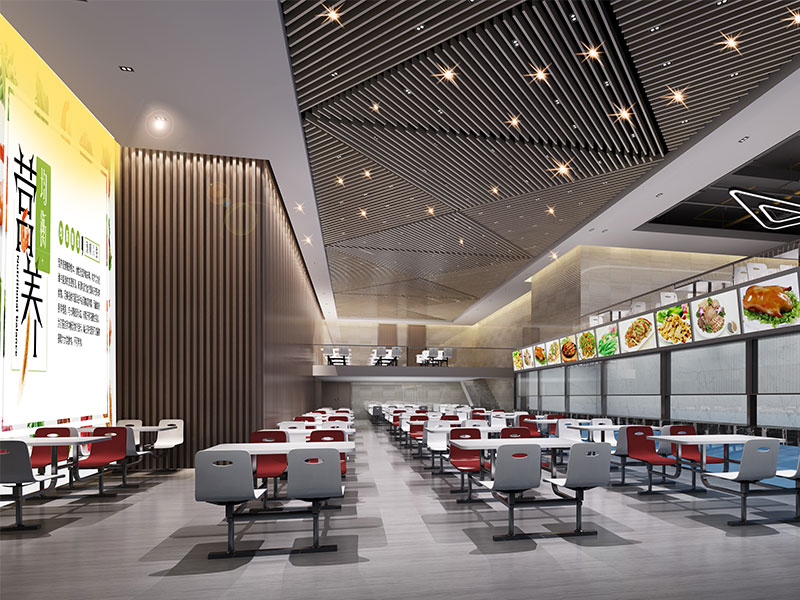
You are a GUI agent. You are given a task and a screenshot of the screen. Output one action in this format:
    pyautogui.click(x=<x>, y=<y>)
    Task: Click on the window
    
    Given the screenshot: What is the action you would take?
    pyautogui.click(x=525, y=386), pyautogui.click(x=554, y=385), pyautogui.click(x=581, y=380), pyautogui.click(x=634, y=380), pyautogui.click(x=702, y=379), pyautogui.click(x=785, y=376)